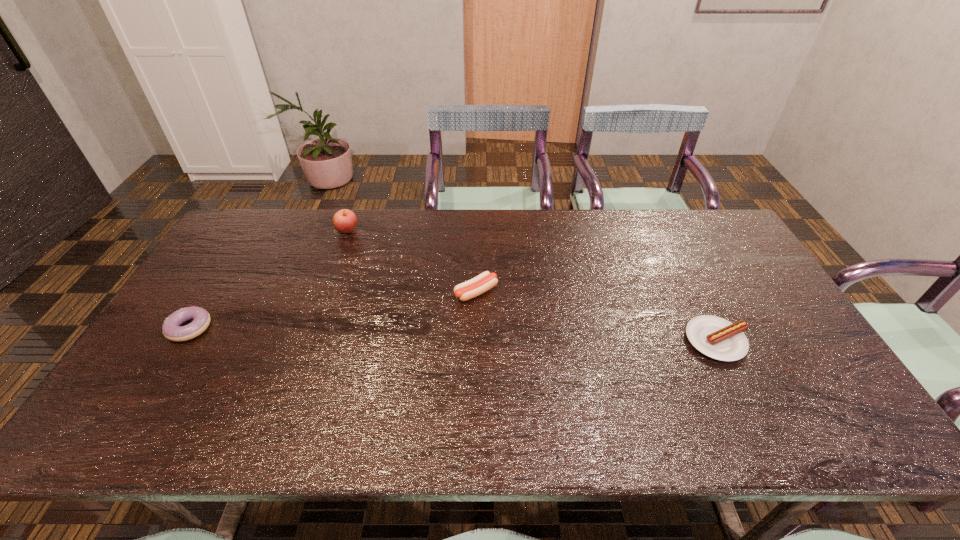
The height and width of the screenshot is (540, 960). Identify the location of vacant space situated 0.290m on the left of the right sausage. (577, 341).

At what (x,y) coordinates should I click in order to perform the action: click on object present at the far edge. Please return your answer as a coordinate pair (x, y). This screenshot has height=540, width=960. Looking at the image, I should click on (344, 221).

Locate an element on the screen. The height and width of the screenshot is (540, 960). object that is at the left edge is located at coordinates (171, 329).

Find the location of a particular element. This screenshot has height=540, width=960. object positioned at the right edge is located at coordinates (715, 337).

Find the location of `vacant space at the far edge of the desktop`. vacant space at the far edge of the desktop is located at coordinates (566, 221).

In the image, there is a desktop. Identify the location of vacant space at the near edge. The width and height of the screenshot is (960, 540). point(542,414).

In the image, there is a desktop. At what (x,y) coordinates should I click in order to perform the action: click on blank space at the left edge. Please return your answer as a coordinate pair (x, y). This screenshot has width=960, height=540. Looking at the image, I should click on (181, 348).

The width and height of the screenshot is (960, 540). Find the location of `vacant area at the right edge`. vacant area at the right edge is located at coordinates (722, 271).

In the image, there is a desktop. Where is `vacant space at the far left corner`? This screenshot has height=540, width=960. vacant space at the far left corner is located at coordinates pyautogui.click(x=231, y=229).

Image resolution: width=960 pixels, height=540 pixels. I want to click on vacant space at the far right corner of the desktop, so click(688, 222).